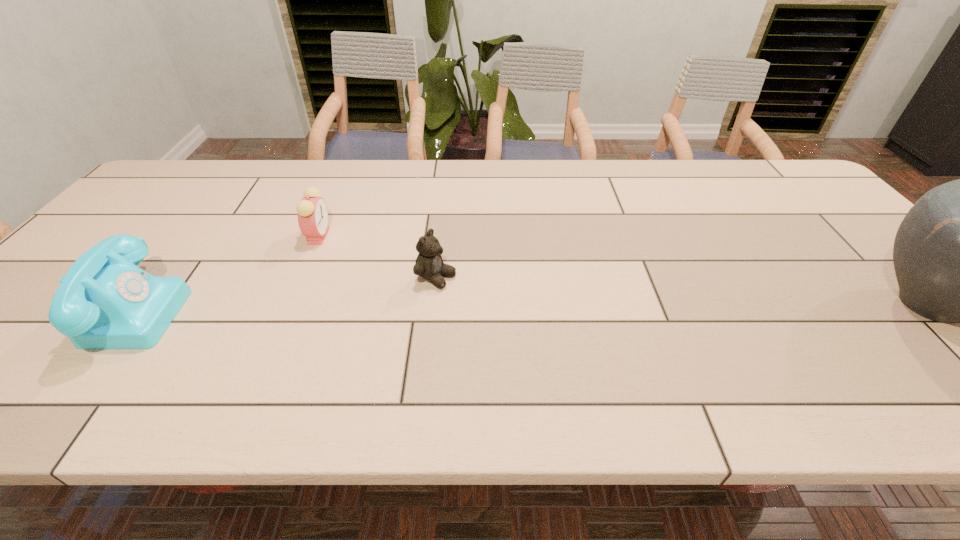
I want to click on free space that is in between the second tallest object and the farthest object, so click(226, 272).

This screenshot has height=540, width=960. Find the location of `vacant region between the teddy bear and the second tallest object`. vacant region between the teddy bear and the second tallest object is located at coordinates (285, 293).

Locate an element on the screen. vacant area between the farthest object and the telephone is located at coordinates (226, 272).

You are a GUI agent. You are given a task and a screenshot of the screen. Output one action in this format:
    pyautogui.click(x=<x>, y=<y>)
    Task: Click on the vacant space in between the third shortest object and the second object from left to right
    The width and height of the screenshot is (960, 540).
    Given the screenshot: What is the action you would take?
    pyautogui.click(x=226, y=272)

Identify the location of free space between the teddy bear and the leftmost object. The image size is (960, 540). (285, 293).

Where is `object that is the closest to the second tallest object`? object that is the closest to the second tallest object is located at coordinates (312, 211).

Identify which object is located as the third nearest to the farthest object. Please provide its 2D coordinates. Your answer should be formatted as a tuple, i.e. [(x, y)], where the tuple contains the x and y coordinates of a point satisfying the conditions above.

[(959, 255)]